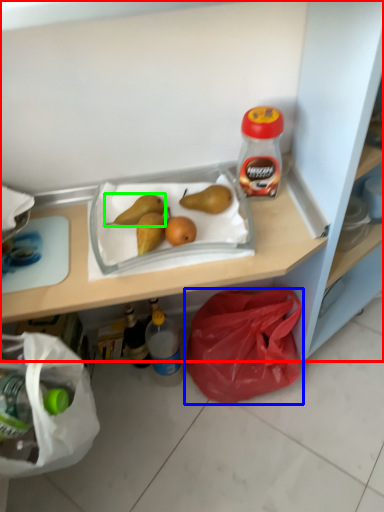
Question: Estimate the real-world distances between objects in this image. Which object is closer to shelf (highlighted by a red box), plastic bag (highlighted by a blue box) or pear (highlighted by a green box)?

Choices:
 (A) plastic bag
 (B) pear

Answer: (B)